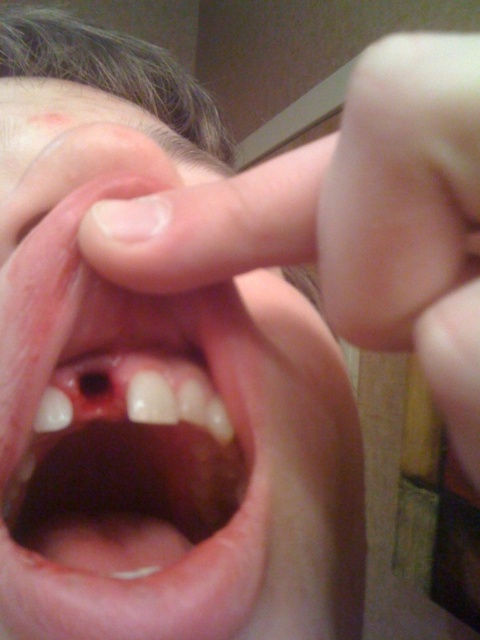
Is pink flesh-colored mouth at center positioned in front of smooth flesh at upper right?

No, it is not.

This screenshot has height=640, width=480. What are the coordinates of `pink flesh-colored mouth at center` in the screenshot? It's located at (158, 412).

Can you confirm if smooth flesh-colored gums at center is taller than smooth flesh at upper right?

Incorrect, smooth flesh-colored gums at center's height is not larger of smooth flesh at upper right's.

Who is shorter, smooth flesh-colored gums at center or smooth flesh at upper right?

With less height is smooth flesh-colored gums at center.

This screenshot has height=640, width=480. Find the location of `smooth flesh-colored gums at center`. smooth flesh-colored gums at center is located at coordinates (134, 508).

Where is `smooth flesh-colored gums at center`? Image resolution: width=480 pixels, height=640 pixels. smooth flesh-colored gums at center is located at coordinates (134, 508).

Is pink flesh-colored mouth at center shorter than smooth flesh-colored gums at center?

Incorrect, pink flesh-colored mouth at center's height does not fall short of smooth flesh-colored gums at center's.

Which is behind, point (335, 618) or point (244, 435)?

The point (335, 618) is behind.

Find the location of `pink flesh-colored mouth at center`. pink flesh-colored mouth at center is located at coordinates (158, 412).